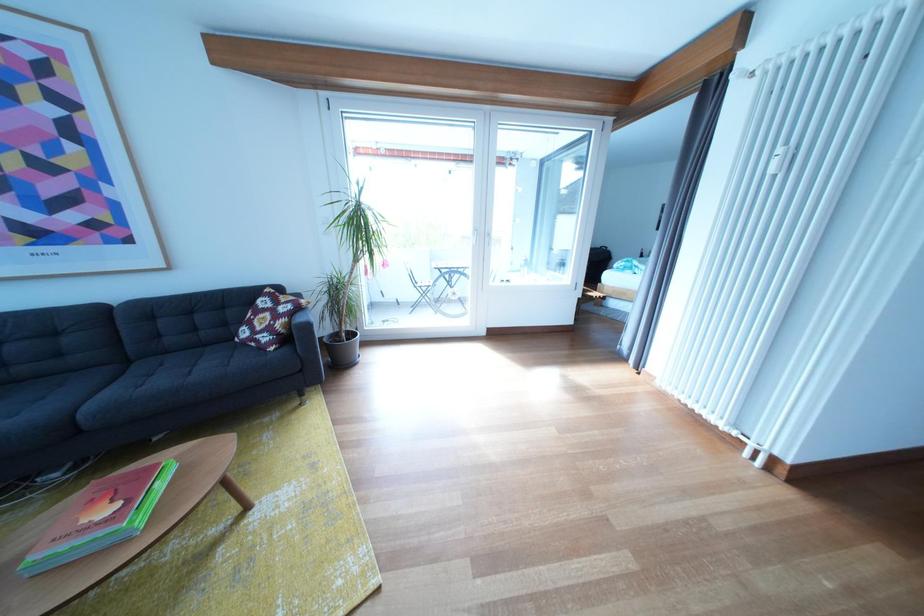
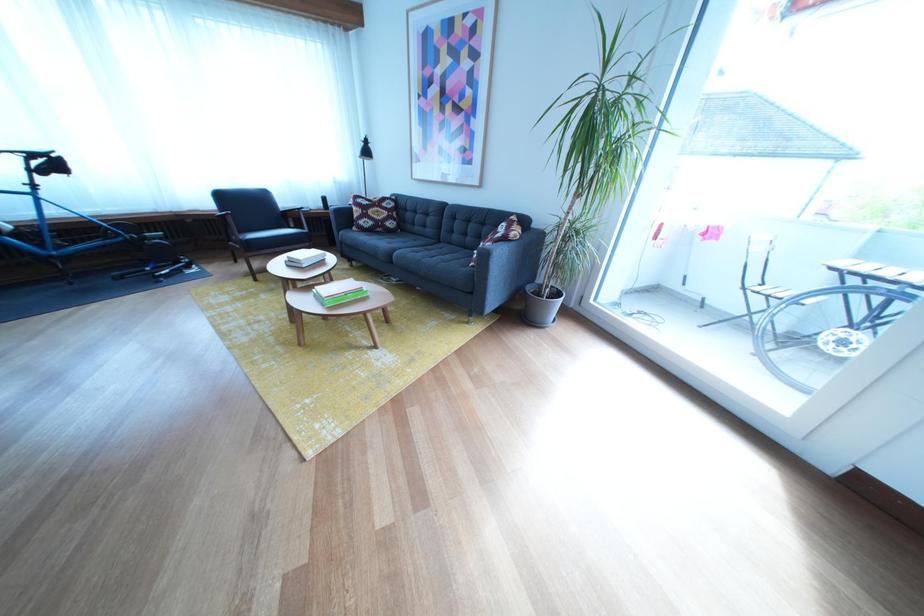
Question: I am providing you with two images of the same scene from different viewpoints. Which of the following objects are not visible in image2?

Choices:
 (A) bicycle wheel
 (B) wooden chair armrest
 (C) black chair sitting surface
 (D) none of these

Answer: (D)